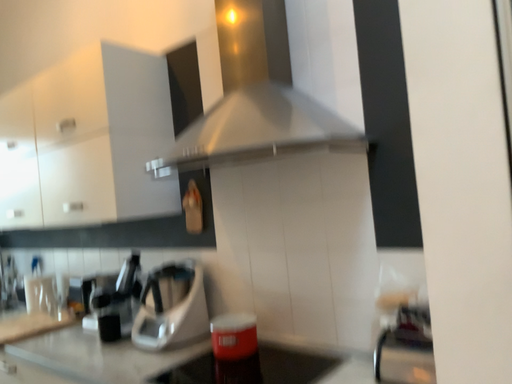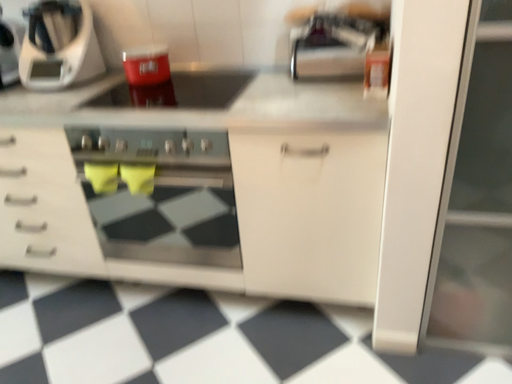
Question: Which way did the camera rotate in the video?

Choices:
 (A) rotated upward
 (B) rotated downward

Answer: (B)